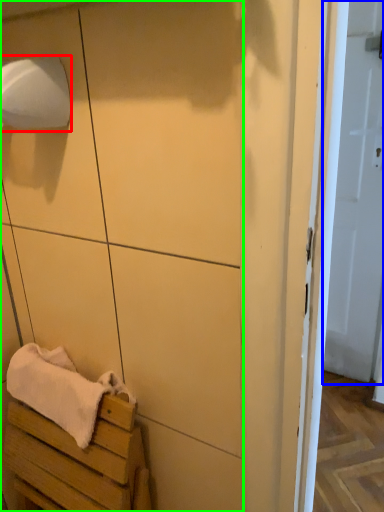
Question: Which object is the farthest from toilet paper (highlighted by a red box)? Choose among these: door (highlighted by a blue box) or cabinetry (highlighted by a green box).

Choices:
 (A) door
 (B) cabinetry

Answer: (A)